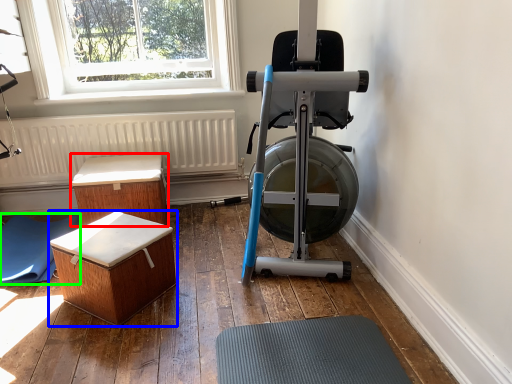
Question: Considering the real-world distances, which object is closest to furniture (highlighted by a red box)? furniture (highlighted by a blue box) or yoga mat (highlighted by a green box).

Choices:
 (A) furniture
 (B) yoga mat

Answer: (B)